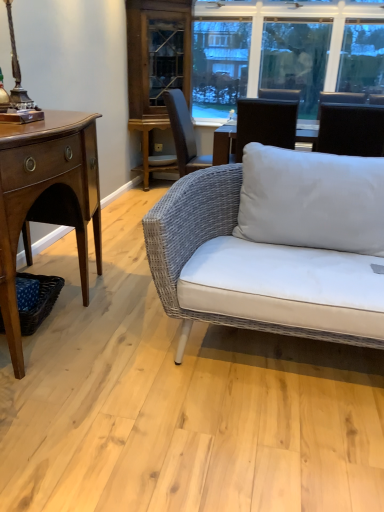
Question: From a real-world perspective, is blue woven picnic basket at lower left positioned above or below mahogany wood desk at left?

Choices:
 (A) below
 (B) above

Answer: (A)

Question: In terms of height, does blue woven picnic basket at lower left look taller or shorter compared to mahogany wood desk at left?

Choices:
 (A) tall
 (B) short

Answer: (B)

Question: Which object is the closest to the blue woven picnic basket at lower left?

Choices:
 (A) black fabric chair at upper right
 (B) wooden cabinet at center
 (C) metallic bronze table lamp at upper left
 (D) clear glass window at upper center
 (E) mahogany wood desk at left

Answer: (E)

Question: Estimate the real-world distances between objects in this image. Which object is closer to the mahogany wood desk at left?

Choices:
 (A) metallic bronze table lamp at upper left
 (B) clear glass window at upper center
 (C) black fabric chair at upper right
 (D) wooden cabinet at center
 (E) blue woven picnic basket at lower left

Answer: (E)